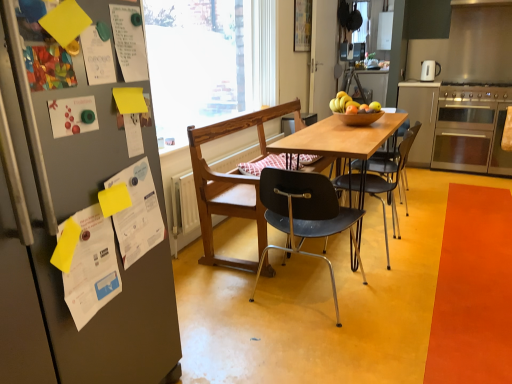
Where is `free space on the front side of black plastic chair at center, which appears as the 1th chair when viewed from the back`? This screenshot has height=384, width=512. free space on the front side of black plastic chair at center, which appears as the 1th chair when viewed from the back is located at coordinates (403, 276).